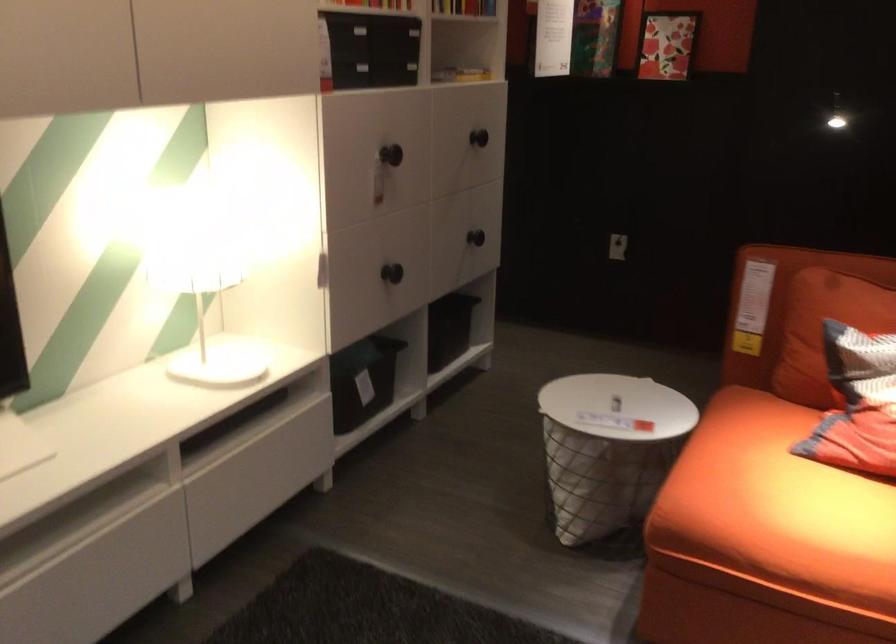
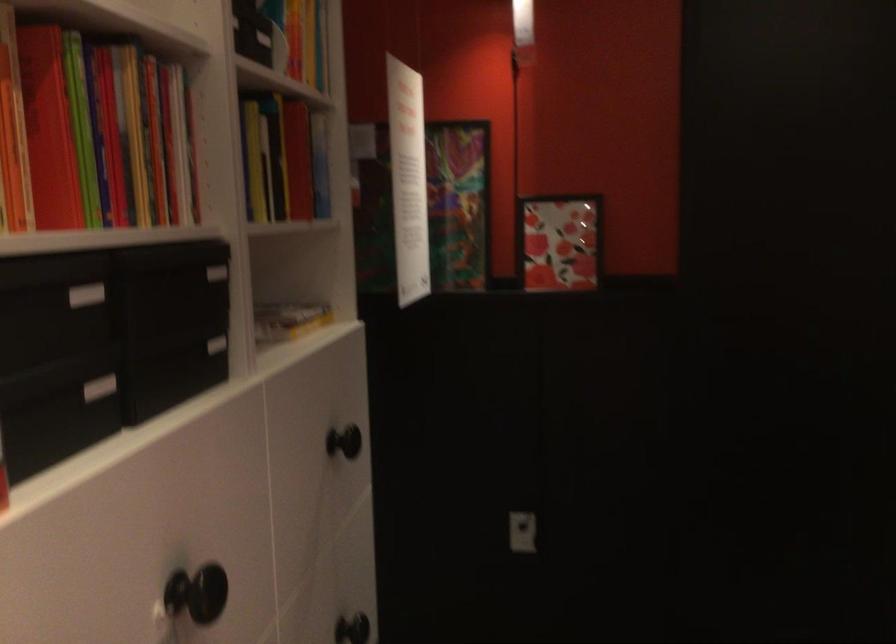
Where in the second image is the point corresponding to the point at 484,223 from the first image?

(351, 629)